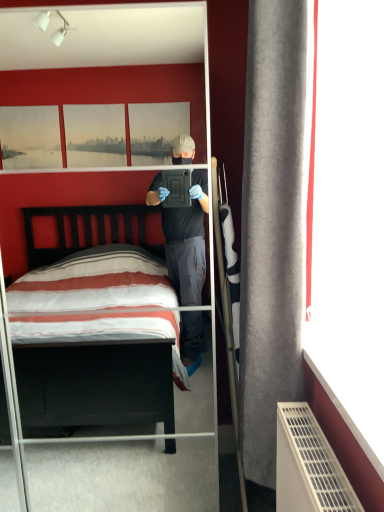
Question: Should I look upward or downward to see clear glass mirror at center?

Choices:
 (A) down
 (B) up

Answer: (A)

Question: Is gray fabric curtain at right further to camera compared to clear glass mirror at center?

Choices:
 (A) no
 (B) yes

Answer: (A)

Question: Considering the relative sizes of gray fabric curtain at right and clear glass mirror at center in the image provided, is gray fabric curtain at right bigger than clear glass mirror at center?

Choices:
 (A) no
 (B) yes

Answer: (A)

Question: Is the depth of gray fabric curtain at right less than that of clear glass mirror at center?

Choices:
 (A) yes
 (B) no

Answer: (A)

Question: Is the surface of gray fabric curtain at right in direct contact with clear glass mirror at center?

Choices:
 (A) no
 (B) yes

Answer: (A)

Question: From a real-world perspective, is gray fabric curtain at right over clear glass mirror at center?

Choices:
 (A) yes
 (B) no

Answer: (A)

Question: Does gray fabric curtain at right turn towards clear glass mirror at center?

Choices:
 (A) no
 (B) yes

Answer: (B)

Question: Is clear glass mirror at center outside gray fabric curtain at right?

Choices:
 (A) no
 (B) yes

Answer: (B)

Question: Is clear glass mirror at center smaller than gray fabric curtain at right?

Choices:
 (A) yes
 (B) no

Answer: (B)

Question: Does clear glass mirror at center come in front of gray fabric curtain at right?

Choices:
 (A) yes
 (B) no

Answer: (B)

Question: Is gray fabric curtain at right completely or partially inside clear glass mirror at center?

Choices:
 (A) yes
 (B) no

Answer: (B)

Question: Is clear glass mirror at center aimed at gray fabric curtain at right?

Choices:
 (A) yes
 (B) no

Answer: (B)

Question: Is clear glass mirror at center with gray fabric curtain at right?

Choices:
 (A) no
 (B) yes

Answer: (A)

Question: Is clear glass mirror at center situated inside gray fabric curtain at right or outside?

Choices:
 (A) inside
 (B) outside

Answer: (B)